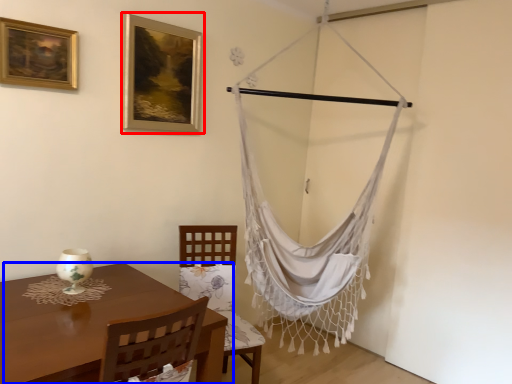
Question: Which of the following is the farthest to the observer, picture frame (highlighted by a red box) or table (highlighted by a blue box)?

Choices:
 (A) picture frame
 (B) table

Answer: (A)